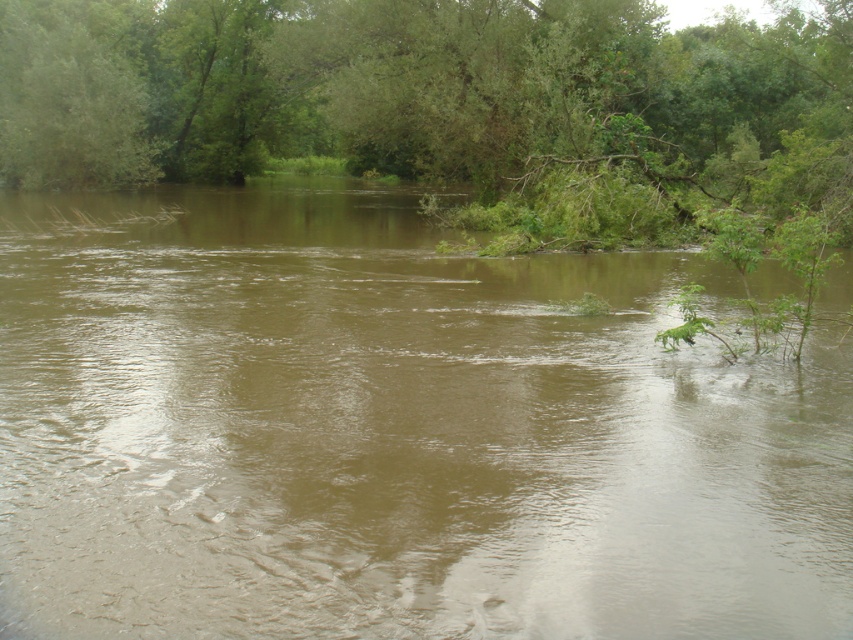
You are standing at the edge of the river and want to take a photo of the green leafy tree at upper center. However, there is brown muddy water at center in the way. Can you see the tree clearly through the water?

The brown muddy water at center is closer to the viewer than the green leafy tree at upper center, so the water may block your view of the tree or make it appear blurred or obscured.

You are standing at the point marked as point [392,433] and want to cross the river. What is the nearest object to you?

The nearest object to you at point [392,433] is the brown muddy water at center, as you are standing in it.